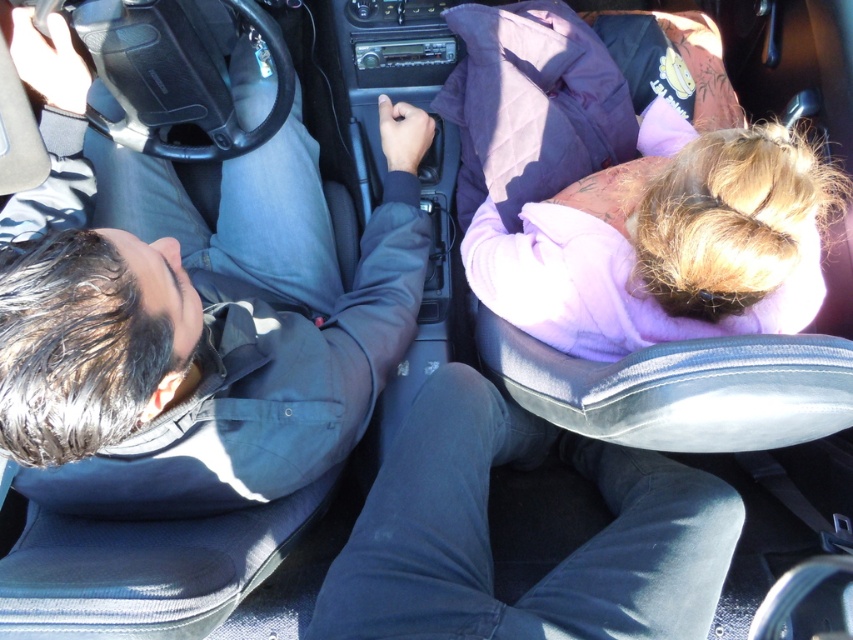
Question: Which of the following is the farthest from the observer?

Choices:
 (A) dark blue shirt at center
 (B) purple fleece jacket at upper right

Answer: (B)

Question: Can you confirm if dark blue shirt at center is positioned above purple fleece jacket at upper right?

Choices:
 (A) no
 (B) yes

Answer: (A)

Question: Is dark blue shirt at center above purple fleece jacket at upper right?

Choices:
 (A) yes
 (B) no

Answer: (B)

Question: Is dark blue shirt at center further to camera compared to purple fleece jacket at upper right?

Choices:
 (A) no
 (B) yes

Answer: (A)

Question: Which point is closer to the camera?

Choices:
 (A) purple fleece jacket at upper right
 (B) dark blue shirt at center

Answer: (B)